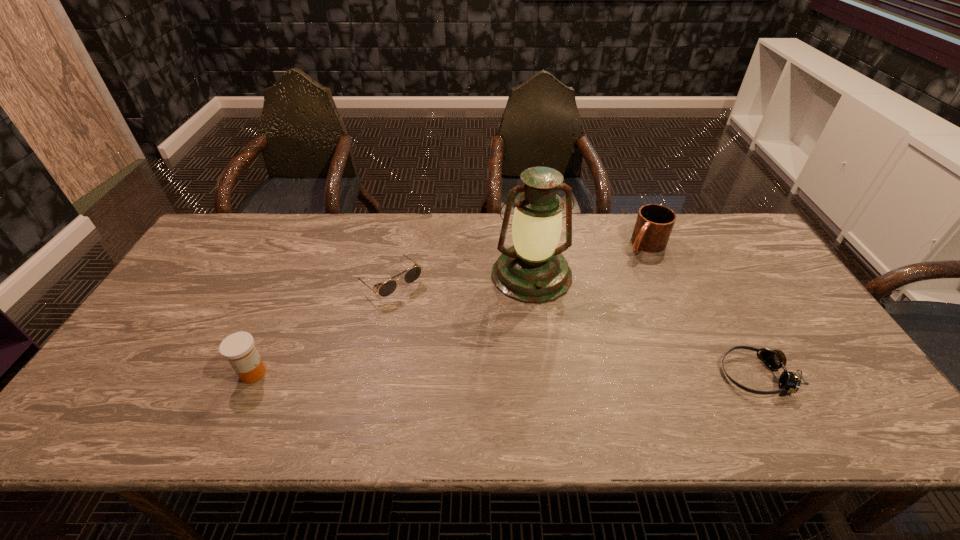
This screenshot has width=960, height=540. I want to click on free space between the third object from right to left and the shortest object, so click(x=643, y=325).

Where is `vacant area that lies between the medicine and the fourth tallest object`? The width and height of the screenshot is (960, 540). vacant area that lies between the medicine and the fourth tallest object is located at coordinates (322, 328).

The width and height of the screenshot is (960, 540). I want to click on unoccupied area between the sunglasses and the shortest object, so click(572, 328).

The width and height of the screenshot is (960, 540). What are the coordinates of `the third closest object relative to the lantern` in the screenshot? It's located at (789, 381).

You are a GUI agent. You are given a task and a screenshot of the screen. Output one action in this format:
    pyautogui.click(x=<x>, y=<y>)
    Task: Click on the object that stands as the fourth closest to the lantern
    
    Given the screenshot: What is the action you would take?
    pyautogui.click(x=238, y=348)